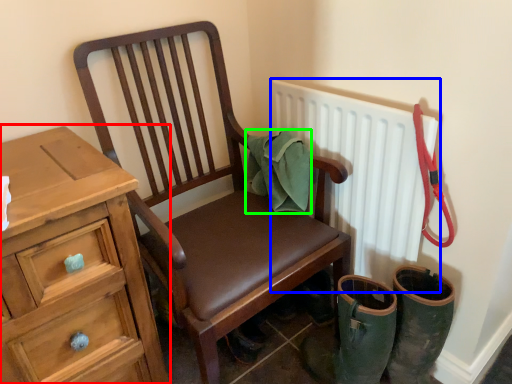
Question: Which object is the closest to the chest of drawers (highlighted by a red box)? Choose among these: radiator (highlighted by a blue box) or material (highlighted by a green box).

Choices:
 (A) radiator
 (B) material

Answer: (B)